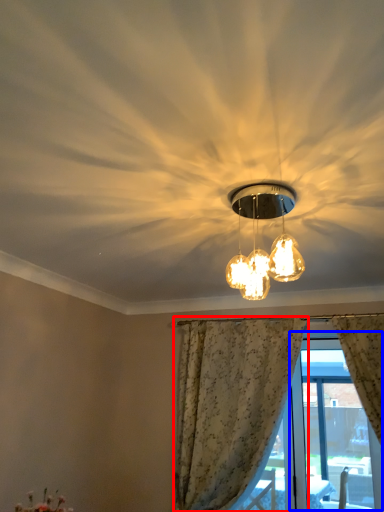
Question: Which object is closer to the camera taking this photo, curtain (highlighted by a red box) or window screen (highlighted by a blue box)?

Choices:
 (A) curtain
 (B) window screen

Answer: (A)